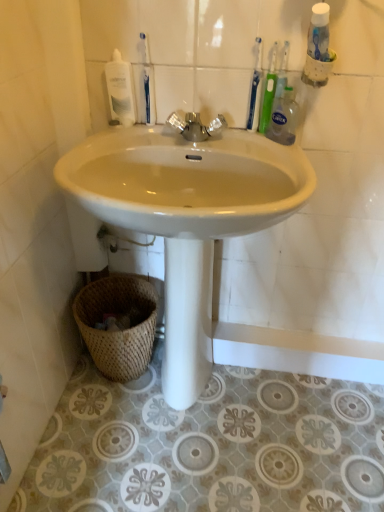
This screenshot has height=512, width=384. Identify the location of free space in front of blue plastic toothbrush at upper center, which appears as the third toothbrush when viewed from the right. 130,139.